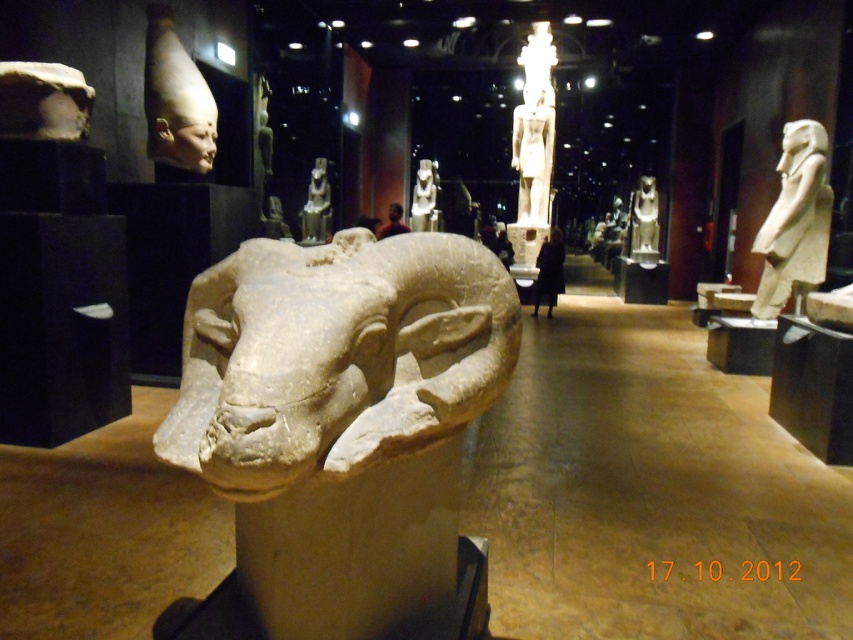
Measure the distance between gray stone ram at center and matte stone statue at center.

The distance of gray stone ram at center from matte stone statue at center is 11.27 meters.

Can you confirm if gray stone ram at center is thinner than matte stone statue at center?

Incorrect, gray stone ram at center's width is not less than matte stone statue at center's.

Identify the location of gray stone ram at center. (335, 356).

Which is more to the right, matte beige head at upper left or polished stone statue at center?

Positioned to the right is polished stone statue at center.

Is point (177, 116) closer to viewer compared to point (640, 196)?

Yes, point (177, 116) is closer to viewer.

Identify the location of matte beige head at upper left. (175, 99).

Locate an element on the screen. matte beige head at upper left is located at coordinates (175, 99).

Which is below, matte beige head at upper left or matte stone statue at center?

Positioned lower is matte beige head at upper left.

From the picture: Who is more forward, (x=195, y=86) or (x=422, y=205)?

Positioned in front is point (x=195, y=86).

Find the location of a particular element. The width and height of the screenshot is (853, 640). matte beige head at upper left is located at coordinates (175, 99).